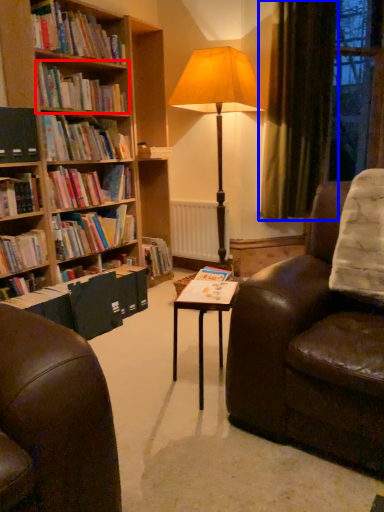
Question: Among these objects, which one is nearest to the camera, book (highlighted by a red box) or curtain (highlighted by a blue box)?

Choices:
 (A) book
 (B) curtain

Answer: (A)